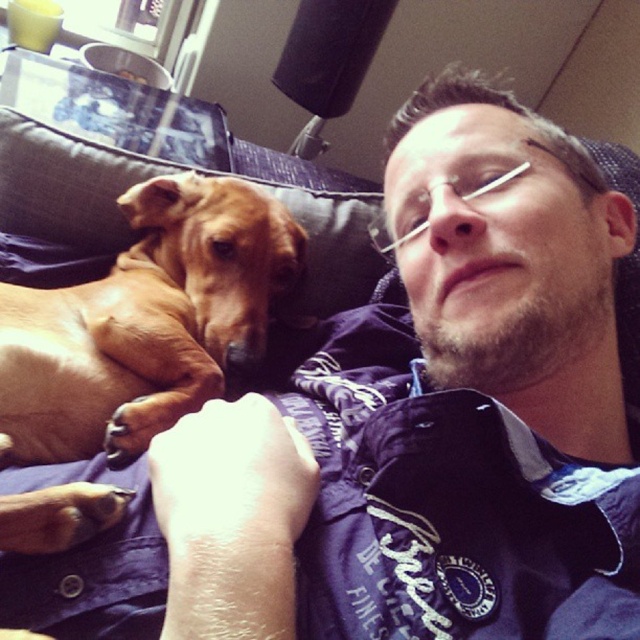
Can you confirm if brown smooth dog at left is positioned above brown fabric pillow at upper left?

No.

Which is more to the left, brown smooth dog at left or brown fabric pillow at upper left?

From the viewer's perspective, brown smooth dog at left appears more on the left side.

Between point (48, 420) and point (321, 305), which one is positioned in front?

Point (48, 420)

The height and width of the screenshot is (640, 640). What are the coordinates of `brown smooth dog at left` in the screenshot? It's located at (145, 323).